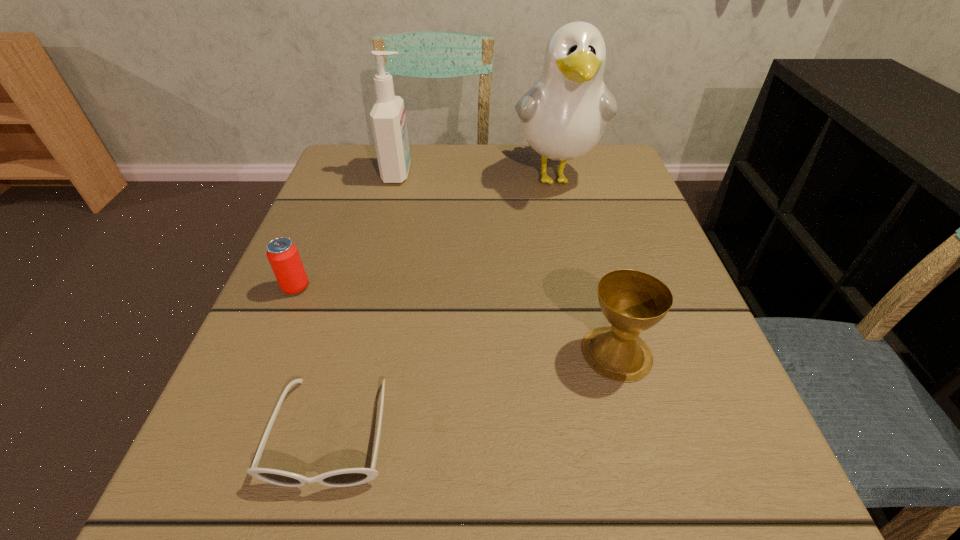
Locate an element on the screen. The image size is (960, 540). the tallest object is located at coordinates (563, 116).

This screenshot has height=540, width=960. I want to click on the fourth shortest object, so click(x=388, y=121).

At what (x,y) coordinates should I click in order to perform the action: click on the third shortest object. Please return your answer as a coordinate pair (x, y). Looking at the image, I should click on (632, 301).

This screenshot has width=960, height=540. What are the coordinates of `the leftmost object` in the screenshot? It's located at (283, 256).

The image size is (960, 540). In order to click on beer can in this screenshot , I will do `click(283, 256)`.

I want to click on sunglasses, so (348, 477).

Locate an element on the screen. The height and width of the screenshot is (540, 960). free space located 0.400m on the beak of the tallest object is located at coordinates (599, 362).

Where is `vacant space located 0.060m on the front label of the fourth shortest object`? The height and width of the screenshot is (540, 960). vacant space located 0.060m on the front label of the fourth shortest object is located at coordinates (438, 173).

Where is `free space located 0.280m on the back of the third shortest object`? This screenshot has width=960, height=540. free space located 0.280m on the back of the third shortest object is located at coordinates (582, 222).

Locate an element on the screen. The width and height of the screenshot is (960, 540). blank area located on the right of the third farthest object is located at coordinates (444, 287).